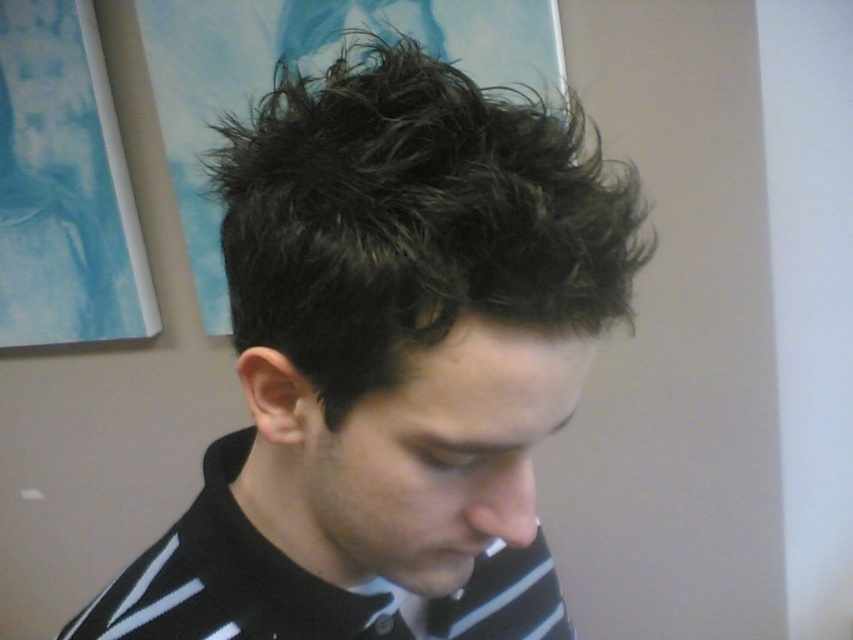
You are a photographer adjusting the camera focus. The subject has dark brown hair at center and a black striped shirt at center. Which object is wider so that you should focus on it to ensure clarity?

The dark brown hair at center is wider than the black striped shirt at center, so focusing on it will ensure clarity.

You are an artist trying to sketch the person in the image. You need to place the dark brown hair at center in your drawing. What are the coordinates for the center of the dark brown hair?

The center of the dark brown hair at center is located at coordinates 0.566 on the x axis and 0.457 on the y axis.

You are a photographer adjusting the focus on your camera. You notice the black striped shirt at center and the matte black mouth at lower center. Which object should you focus on if you want to capture the wider subject in sharp detail?

The black striped shirt at center should be focused on because its width is larger than the matte black mouth at lower center, making it the wider subject.